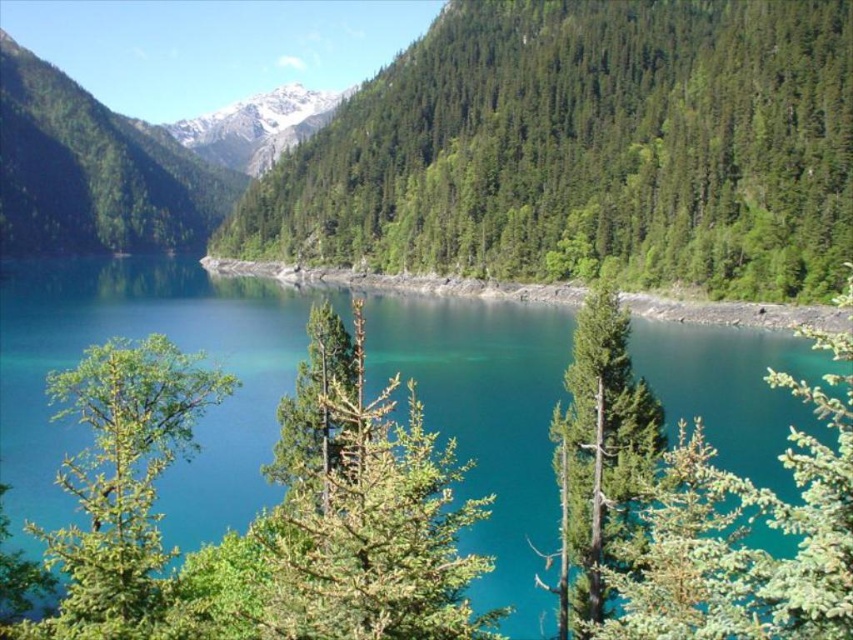
Find the location of a particular element. green textured tree at center is located at coordinates (585, 148).

Between point (543, 83) and point (155, 365), which one is positioned behind?

The point (543, 83) is behind.

At what (x,y) coordinates should I click in order to perform the action: click on green textured tree at center. Please return your answer as a coordinate pair (x, y). This screenshot has height=640, width=853. Looking at the image, I should click on (585, 148).

Does green needle-like tree at center have a lesser height compared to green matte tree at left?

No, green needle-like tree at center is not shorter than green matte tree at left.

Locate an element on the screen. green needle-like tree at center is located at coordinates (366, 509).

Between point (376, 627) and point (195, 372), which one is positioned in front?

Point (376, 627)

At what (x,y) coordinates should I click in order to perform the action: click on green needle-like tree at center. Please return your answer as a coordinate pair (x, y). The height and width of the screenshot is (640, 853). Looking at the image, I should click on (366, 509).

Which of these two, green textured tree at center or teal glossy water at center, stands shorter?

Standing shorter between the two is teal glossy water at center.

Does point (567, 99) come farther from viewer compared to point (38, 330)?

Yes, point (567, 99) is farther from viewer.

Is point (780, 243) positioned in front of point (456, 396)?

No, it is not.

The width and height of the screenshot is (853, 640). I want to click on green textured tree at center, so click(585, 148).